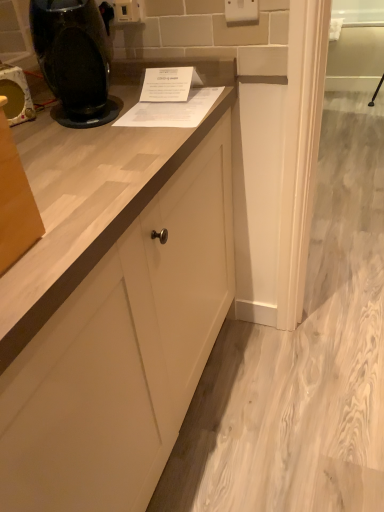
Question: Is white plastic electric outlet at upper center, acting as the 1th electric outlet starting from the back, in front of matte black coffee machine at left?

Choices:
 (A) yes
 (B) no

Answer: (B)

Question: Could matte black coffee machine at left be considered to be inside white plastic electric outlet at upper center, which is the 2th electric outlet in right-to-left order?

Choices:
 (A) yes
 (B) no

Answer: (B)

Question: Can you confirm if white plastic electric outlet at upper center, which is the first electric outlet in left-to-right order, is shorter than matte black coffee machine at left?

Choices:
 (A) yes
 (B) no

Answer: (A)

Question: Can you confirm if white plastic electric outlet at upper center, which is the 2th electric outlet in right-to-left order, is wider than matte black coffee machine at left?

Choices:
 (A) yes
 (B) no

Answer: (B)

Question: Can you see white plastic electric outlet at upper center, which is the first electric outlet in left-to-right order, touching matte black coffee machine at left?

Choices:
 (A) no
 (B) yes

Answer: (A)

Question: Looking at the image, does white plastic electric outlet at upper center, which is the first electric outlet in left-to-right order, seem bigger or smaller compared to black glossy coffee machine at upper left?

Choices:
 (A) big
 (B) small

Answer: (B)

Question: Visually, is white plastic electric outlet at upper center, acting as the 1th electric outlet starting from the back, positioned to the left or to the right of black glossy coffee machine at upper left?

Choices:
 (A) right
 (B) left

Answer: (A)

Question: In terms of height, does white plastic electric outlet at upper center, which is the 2th electric outlet in right-to-left order, look taller or shorter compared to black glossy coffee machine at upper left?

Choices:
 (A) tall
 (B) short

Answer: (B)

Question: Is white plastic electric outlet at upper center, the 2th electric outlet in the front-to-back sequence, in front of or behind black glossy coffee machine at upper left in the image?

Choices:
 (A) front
 (B) behind

Answer: (B)

Question: From a real-world perspective, relative to matte black coffee machine at left, is white plastic electric outlet at upper center, which is the 2th electric outlet in right-to-left order, vertically above or below?

Choices:
 (A) above
 (B) below

Answer: (A)

Question: Considering their positions, is white plastic electric outlet at upper center, acting as the 1th electric outlet starting from the back, located in front of or behind matte black coffee machine at left?

Choices:
 (A) behind
 (B) front

Answer: (A)

Question: Is point (127, 1) closer or farther from the camera than point (8, 123)?

Choices:
 (A) closer
 (B) farther

Answer: (B)

Question: Is white plastic electric outlet at upper center, which is the first electric outlet in left-to-right order, situated inside matte black coffee machine at left or outside?

Choices:
 (A) outside
 (B) inside

Answer: (A)

Question: Considering the positions of point (127, 5) and point (256, 10), is point (127, 5) closer or farther from the camera than point (256, 10)?

Choices:
 (A) closer
 (B) farther

Answer: (B)

Question: From the image's perspective, is white plastic electric outlet at upper center, which is the 2th electric outlet in right-to-left order, above or below white plastic electric outlet at upper center, the second electric outlet from the left?

Choices:
 (A) below
 (B) above

Answer: (B)